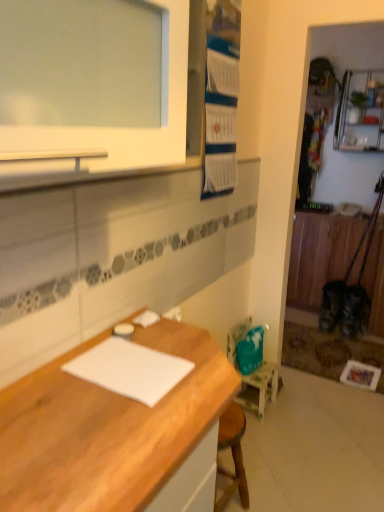
Question: Should I look upward or downward to see metallic silver shelf at upper right?

Choices:
 (A) up
 (B) down

Answer: (A)

Question: Is teal fabric chair at lower right shorter than wooden cabinet at right?

Choices:
 (A) no
 (B) yes

Answer: (B)

Question: Does teal fabric chair at lower right come in front of wooden cabinet at right?

Choices:
 (A) yes
 (B) no

Answer: (A)

Question: From a real-world perspective, is teal fabric chair at lower right physically below wooden cabinet at right?

Choices:
 (A) no
 (B) yes

Answer: (B)

Question: Is teal fabric chair at lower right positioned beyond the bounds of wooden cabinet at right?

Choices:
 (A) no
 (B) yes

Answer: (B)

Question: Does teal fabric chair at lower right have a larger size compared to wooden cabinet at right?

Choices:
 (A) no
 (B) yes

Answer: (A)

Question: From a real-world perspective, is teal fabric chair at lower right on top of wooden cabinet at right?

Choices:
 (A) yes
 (B) no

Answer: (B)

Question: Can you confirm if metallic silver shelf at upper right is smaller than teal fabric chair at lower right?

Choices:
 (A) no
 (B) yes

Answer: (A)

Question: Does metallic silver shelf at upper right appear on the right side of teal fabric chair at lower right?

Choices:
 (A) no
 (B) yes

Answer: (B)

Question: Is metallic silver shelf at upper right looking in the opposite direction of teal fabric chair at lower right?

Choices:
 (A) yes
 (B) no

Answer: (B)

Question: From a real-world perspective, is metallic silver shelf at upper right below teal fabric chair at lower right?

Choices:
 (A) yes
 (B) no

Answer: (B)

Question: Is metallic silver shelf at upper right outside teal fabric chair at lower right?

Choices:
 (A) yes
 (B) no

Answer: (A)

Question: Are metallic silver shelf at upper right and teal fabric chair at lower right located far from each other?

Choices:
 (A) no
 (B) yes

Answer: (B)

Question: From the image's perspective, is teal fabric chair at lower right on white paper at center?

Choices:
 (A) yes
 (B) no

Answer: (B)